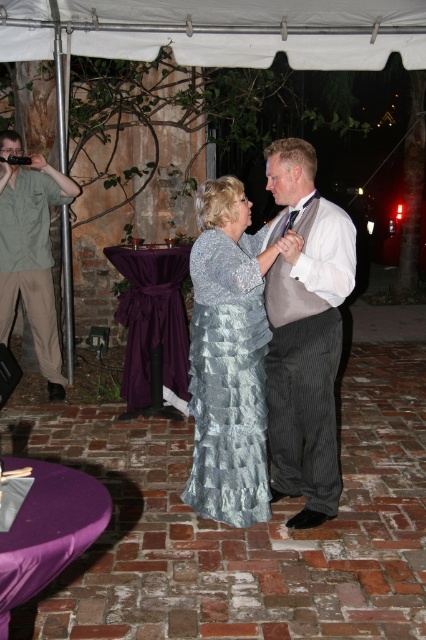
Question: Does white fabric canopy at upper center have a lesser width compared to green shirt at left?

Choices:
 (A) no
 (B) yes

Answer: (A)

Question: Among these points, which one is nearest to the camera?

Choices:
 (A) (247, 252)
 (B) (299, 44)
 (C) (46, 378)

Answer: (A)

Question: Can you confirm if pinstriped fabric suit at center is wider than shiny silver dress at center?

Choices:
 (A) yes
 (B) no

Answer: (B)

Question: Among these points, which one is nearest to the camera?

Choices:
 (A) (238, 240)
 (B) (204, 8)
 (C) (63, 387)
 (D) (353, 278)

Answer: (D)

Question: Can you confirm if white fabric canopy at upper center is smaller than green shirt at left?

Choices:
 (A) yes
 (B) no

Answer: (A)

Question: Based on their relative distances, which object is farther from the shiny silver dress at center?

Choices:
 (A) green shirt at left
 (B) white fabric canopy at upper center

Answer: (B)